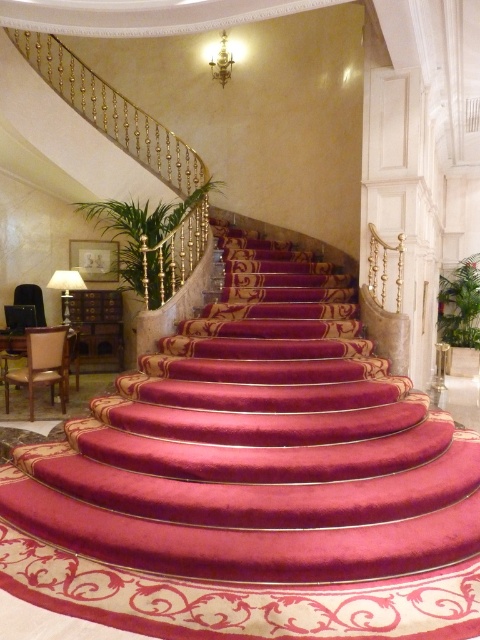
Question: Which object is closer to the camera taking this photo?

Choices:
 (A) gold metallic chandelier at upper center
 (B) matte gold lamp at left

Answer: (B)

Question: Is matte gold lamp at left wider than gold metallic chandelier at upper center?

Choices:
 (A) yes
 (B) no

Answer: (A)

Question: Can you confirm if matte gold lamp at left is smaller than gold metallic chandelier at upper center?

Choices:
 (A) no
 (B) yes

Answer: (A)

Question: Does matte gold lamp at left have a smaller size compared to gold metallic chandelier at upper center?

Choices:
 (A) yes
 (B) no

Answer: (B)

Question: Which point is farther from the camera taking this photo?

Choices:
 (A) (216, 67)
 (B) (74, 280)

Answer: (A)